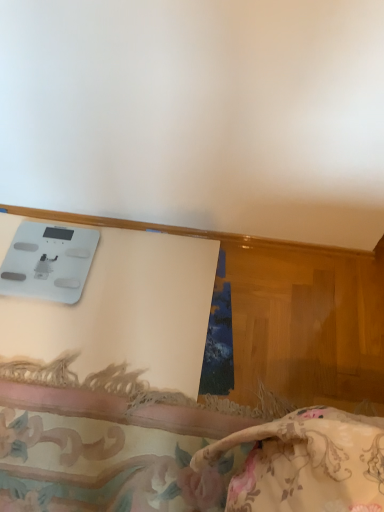
What are the coordinates of `free space above white wood trim at upper center (from a real-world perspective)` in the screenshot? It's located at (183, 221).